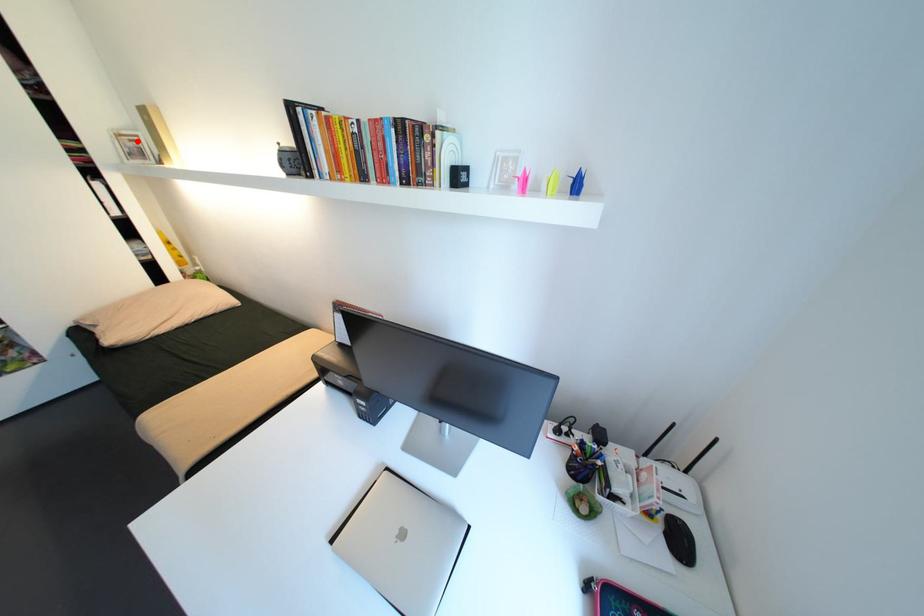
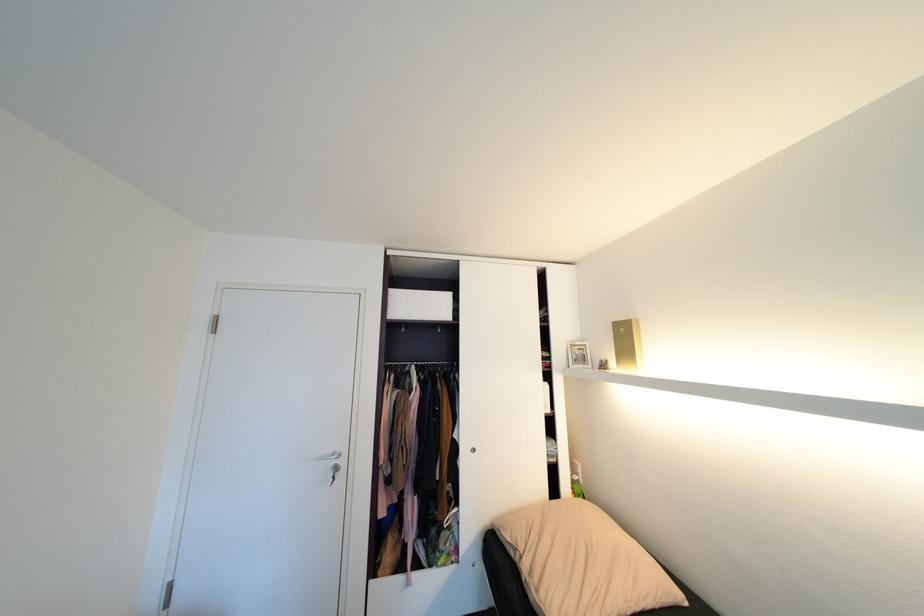
Question: I am providing you with two images of the same scene from different viewpoints. Image1 has a red point marked. In image2, the corresponding 3D location appears at what relative position? Reply with the corresponding letter.

Choices:
 (A) Closer
 (B) Farther

Answer: (A)